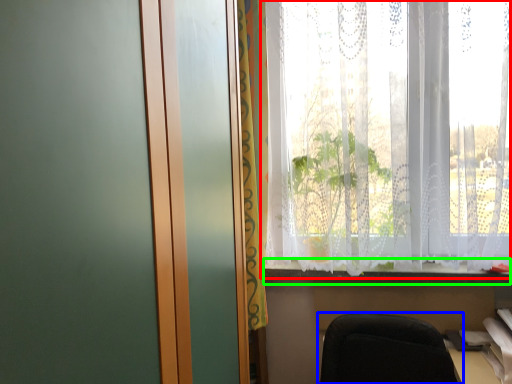
Question: Based on their relative distances, which object is farther from window (highlighted by a red box)? Choose from chair (highlighted by a blue box) and window sill (highlighted by a green box).

Choices:
 (A) chair
 (B) window sill

Answer: (A)